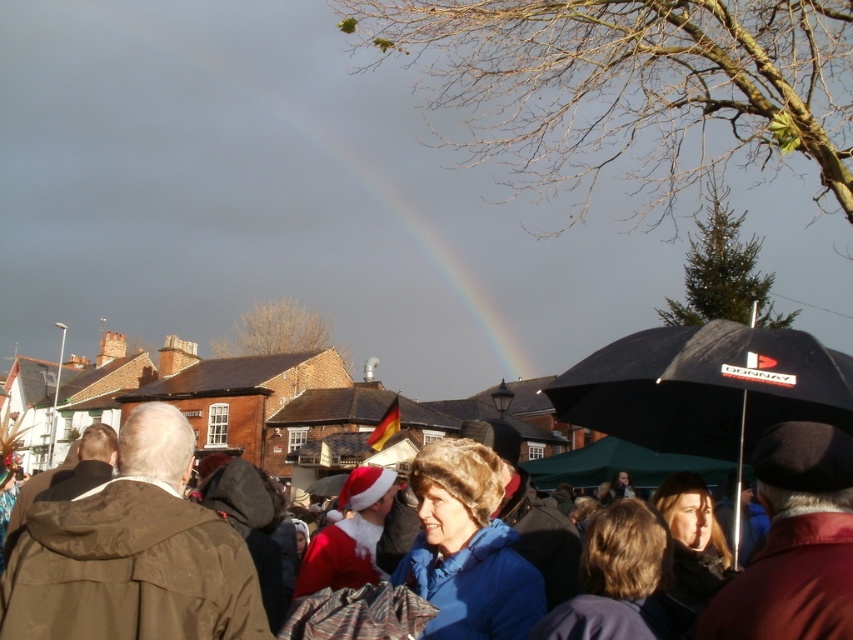
You are standing in the crowd at the event and want to take a photo of both the Santa Claus and the rainbow. You notice two points marked in the image, one at coordinates point (48, 518) and the other at point (700, 368). Which point should you aim your camera towards to ensure both the Santa Claus and the rainbow are in the frame?

You should aim your camera towards point (48, 518) because it is closer to you than point (700, 368). This position will allow you to capture both the Santa Claus in the foreground and the rainbow in the background within the same frame.

You are organizing an outdoor event and need to ensure that the blue woolen jacket at center and the matte black umbrella at right are visible to attendees. Given their sizes, which item would you place higher up on a display stand to ensure visibility?

The matte black umbrella at right should be placed higher up on the display stand because it is taller than the blue woolen jacket at center.